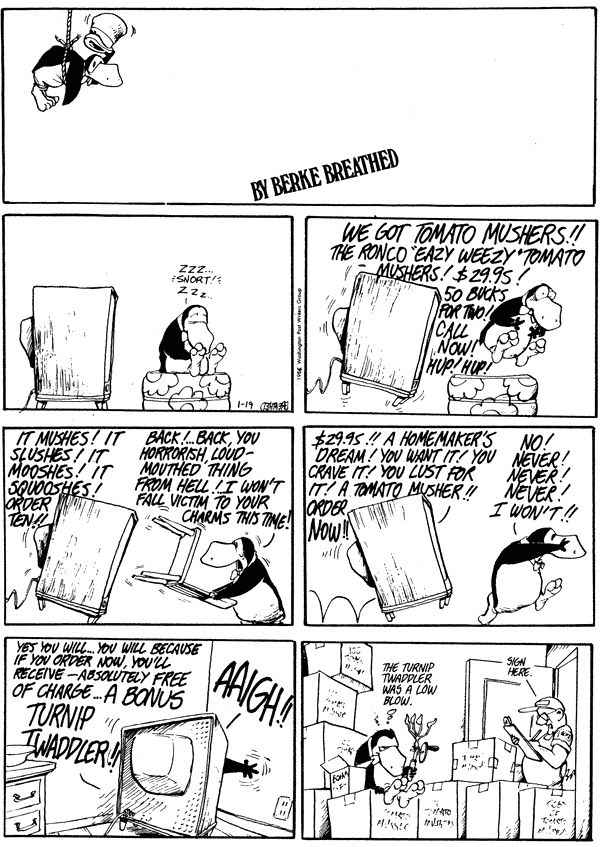
You are a GUI agent. You are given a task and a screenshot of the screen. Output one action in this format:
    pyautogui.click(x=<x>, y=<y>)
    Task: Click on the boxes
    Image resolution: width=600 pixels, height=847 pixels.
    Given the screenshot: What is the action you would take?
    pyautogui.click(x=539, y=806), pyautogui.click(x=516, y=800), pyautogui.click(x=489, y=762), pyautogui.click(x=447, y=800), pyautogui.click(x=400, y=818), pyautogui.click(x=337, y=777), pyautogui.click(x=300, y=817), pyautogui.click(x=319, y=760), pyautogui.click(x=325, y=689), pyautogui.click(x=342, y=663)